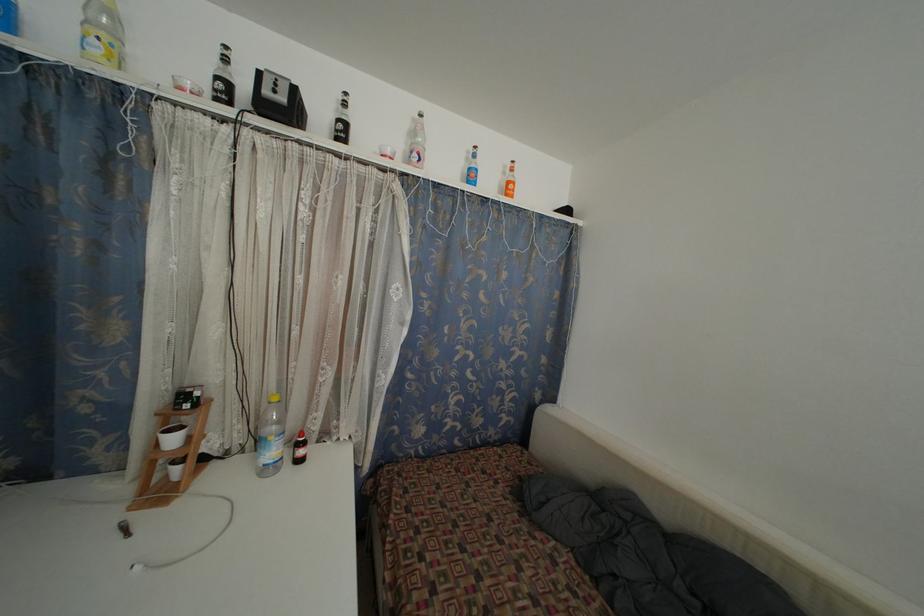
Describe the element at coordinates (223, 79) in the screenshot. The height and width of the screenshot is (616, 924). I see `a black and white bottle` at that location.